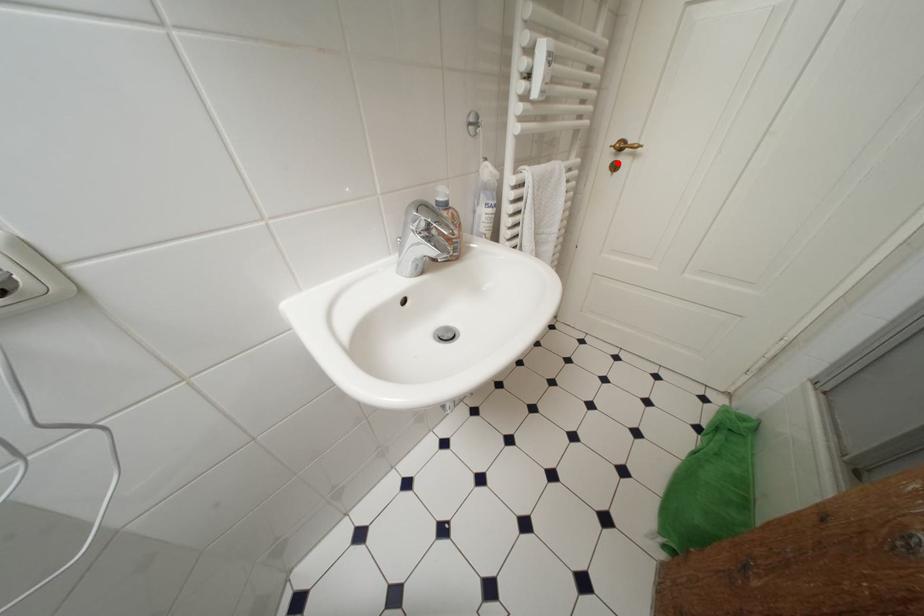
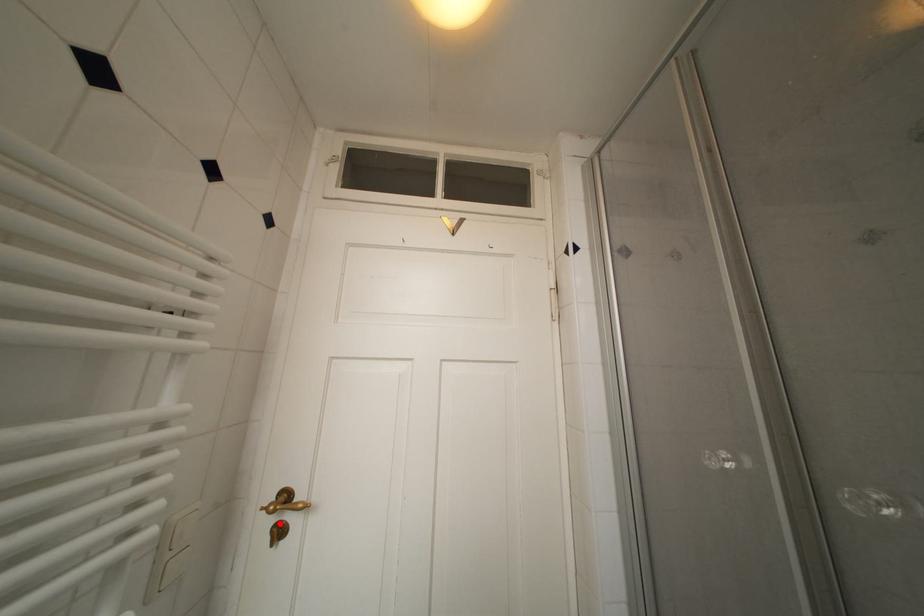
I am providing you with two images of the same scene from different viewpoints. A red point is marked on the first image and another point is marked on the second image. Are the points marked in image1 and image2 representing the same 3D position?

Yes